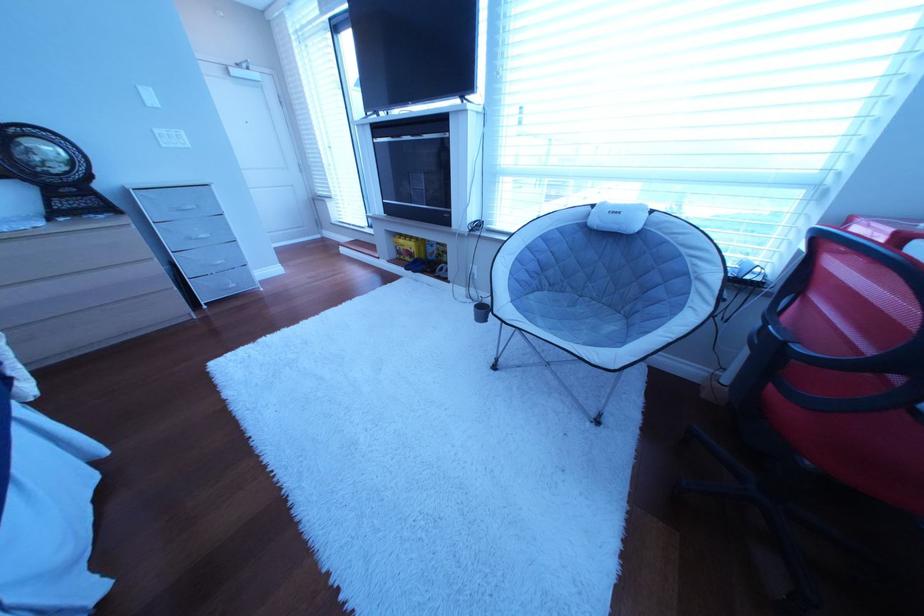
What do you see at coordinates (185, 206) in the screenshot?
I see `the fabric drawer handle` at bounding box center [185, 206].